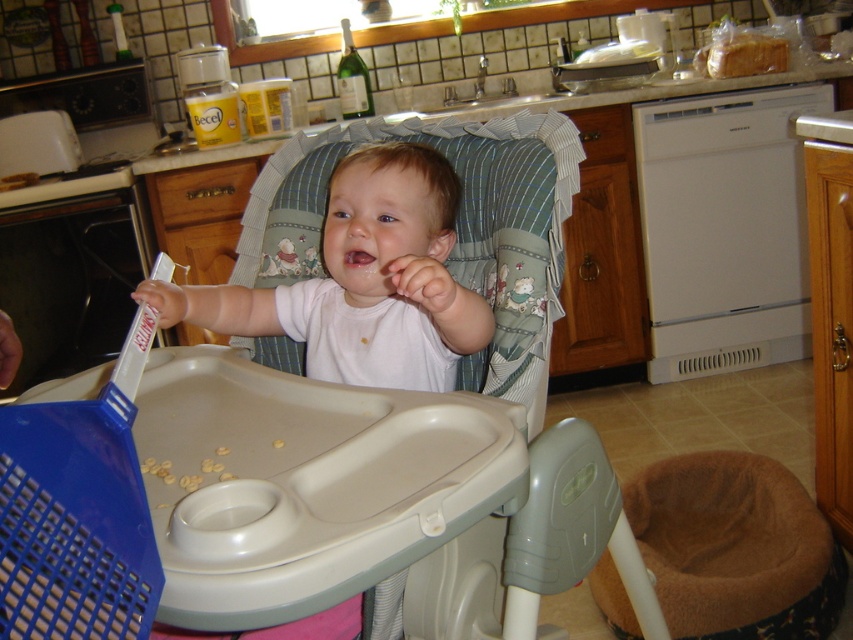
Consider the image. Which is more to the left, brown plush pet bed at lower right or pink glossy lips at center?

Positioned to the left is pink glossy lips at center.

Does point (752, 568) come behind point (344, 259)?

Yes, it is.

The height and width of the screenshot is (640, 853). What are the coordinates of `brown plush pet bed at lower right` in the screenshot? It's located at (735, 547).

Does white matte baby at center appear on the left side of pink glossy lips at center?

Incorrect, white matte baby at center is not on the left side of pink glossy lips at center.

Does point (434, 372) come farther from viewer compared to point (364, 262)?

Yes, point (434, 372) is behind point (364, 262).

Where is `white matte baby at center`? Image resolution: width=853 pixels, height=640 pixels. white matte baby at center is located at coordinates (403, 241).

Is brown plush pet bed at lower right positioned in front of white matte baby at center?

No, it is not.

Does point (654, 525) come closer to viewer compared to point (373, 224)?

No, it is not.

Locate an element on the screen. The height and width of the screenshot is (640, 853). brown plush pet bed at lower right is located at coordinates (735, 547).